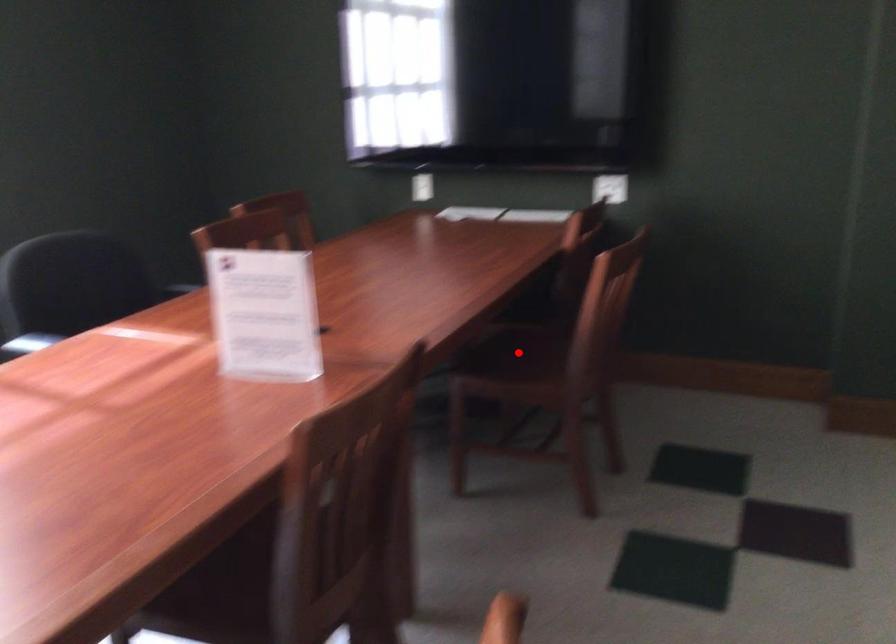
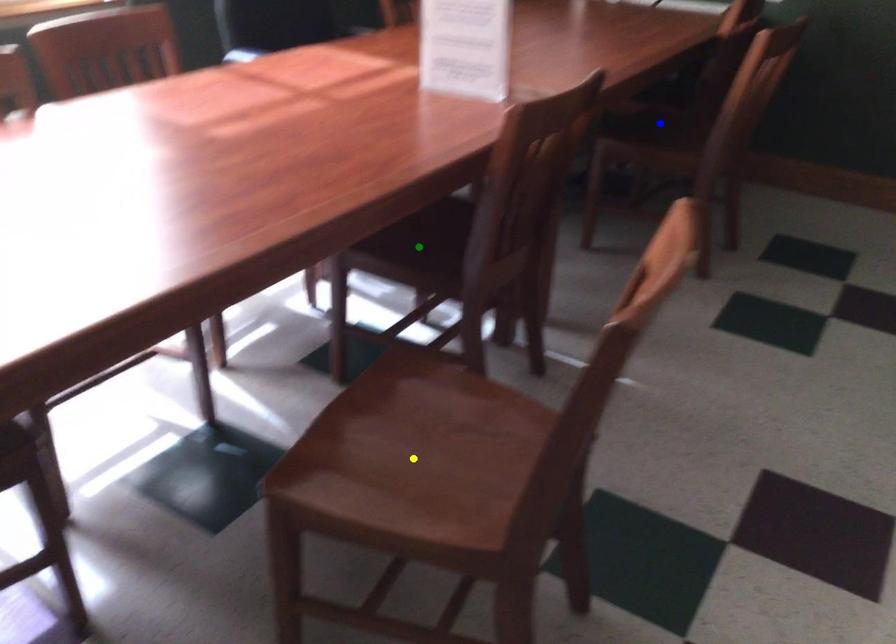
Question: I am providing you with two images of the same scene from different viewpoints. A red point is marked on the first image. You are given multiple points on the second image. Which spot in image 2 lines up with the point in image 1?

Choices:
 (A) yellow point
 (B) blue point
 (C) green point

Answer: (B)